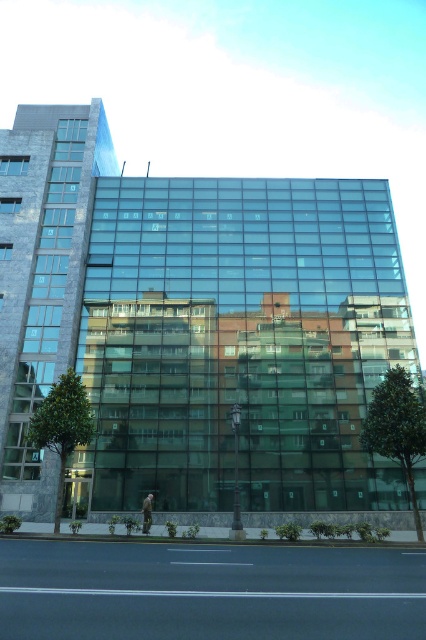
Does green leafy tree at center appear under green leafy tree at lower left?

Yes.

Does point (399, 442) come behind point (63, 378)?

No, (399, 442) is in front of (63, 378).

The width and height of the screenshot is (426, 640). Identify the location of green leafy tree at center. (397, 428).